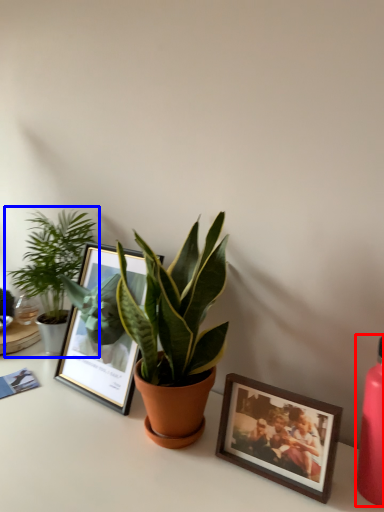
Question: Which point is further to the camera, bottle (highlighted by a red box) or houseplant (highlighted by a blue box)?

Choices:
 (A) bottle
 (B) houseplant

Answer: (B)